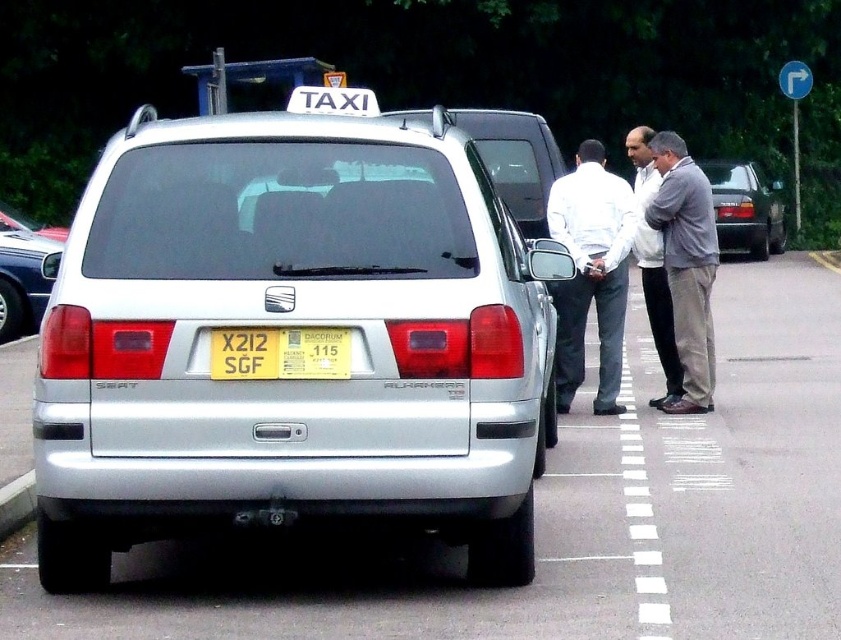
Question: Which of the following is the closest to the observer?

Choices:
 (A) (644, 218)
 (B) (213, 346)

Answer: (B)

Question: Where is light gray shirt at center located in relation to yellow paper at center in the image?

Choices:
 (A) above
 (B) below

Answer: (A)

Question: Considering the relative positions of gray suit at center and yellow paper at center in the image provided, where is gray suit at center located with respect to yellow paper at center?

Choices:
 (A) below
 (B) above

Answer: (B)

Question: Can you confirm if light gray shirt at center is positioned to the right of matte silver suv at center?

Choices:
 (A) yes
 (B) no

Answer: (A)

Question: Which object is the farthest from the yellow matte license plate at rear?

Choices:
 (A) matte gray sedan at center
 (B) light gray shirt at center

Answer: (A)

Question: Which object appears closest to the camera in this image?

Choices:
 (A) yellow matte license plate at rear
 (B) light gray shirt at center
 (C) yellow paper at center

Answer: (A)